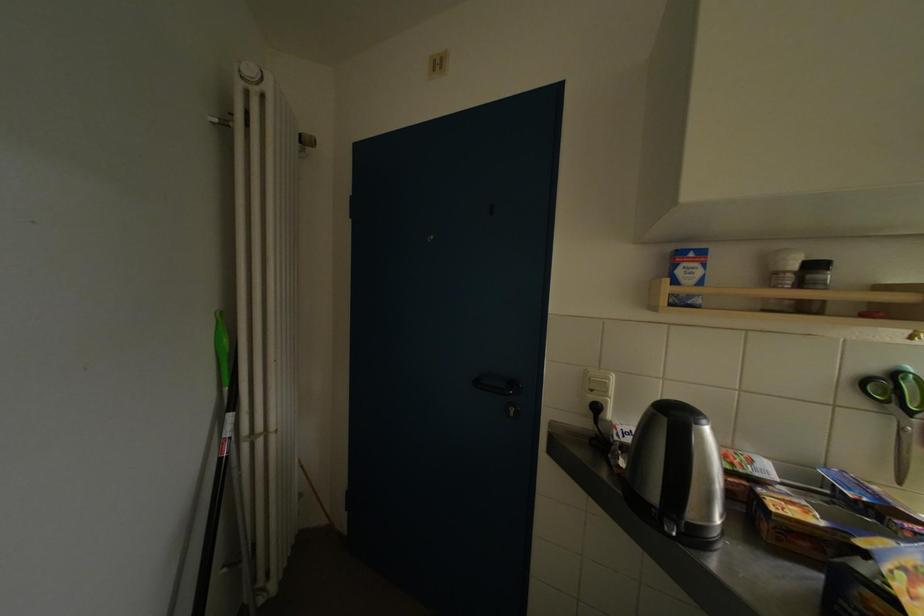
Describe the element at coordinates (598, 387) in the screenshot. I see `the white light switch` at that location.